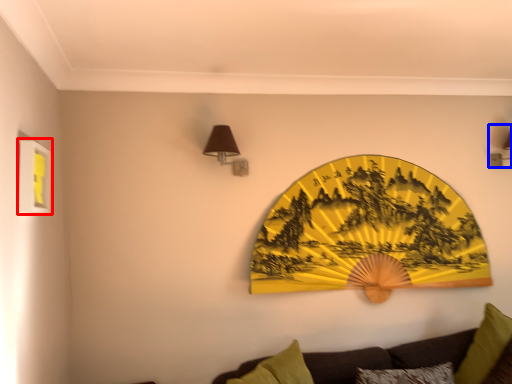
Question: Which object appears farthest to the camera in this image, picture frame (highlighted by a red box) or lamp (highlighted by a blue box)?

Choices:
 (A) picture frame
 (B) lamp

Answer: (B)